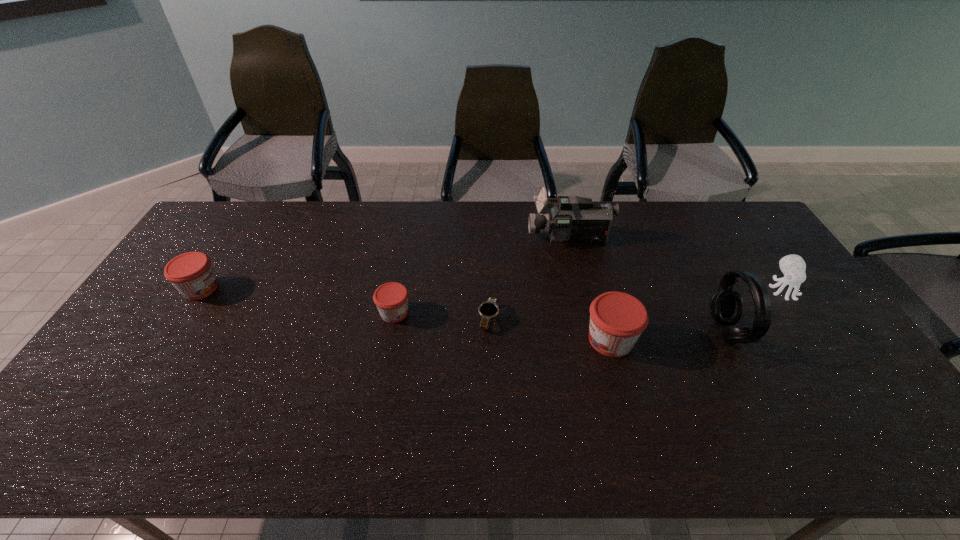
Where is `vacant space located on the front label of the leftmost jam`? vacant space located on the front label of the leftmost jam is located at coordinates (324, 288).

What are the coordinates of `free location located 0.230m on the front label of the second shortest object` in the screenshot? It's located at (490, 313).

Find the location of a particular element. The width and height of the screenshot is (960, 540). vacant space situated on the front label of the tallest jam is located at coordinates (515, 340).

Locate an element on the screen. The width and height of the screenshot is (960, 540). vacant space located 0.190m on the front label of the tallest jam is located at coordinates (515, 340).

This screenshot has height=540, width=960. Find the location of `vacant space located 0.270m on the front label of the tallest jam`. vacant space located 0.270m on the front label of the tallest jam is located at coordinates (486, 340).

The height and width of the screenshot is (540, 960). I want to click on blank space located on the earcups of the second object from right to left, so click(681, 332).

Where is `vacant space located 0.200m on the earcups of the second object from right to left`? Image resolution: width=960 pixels, height=540 pixels. vacant space located 0.200m on the earcups of the second object from right to left is located at coordinates (642, 332).

At what (x,y) coordinates should I click in order to perform the action: click on vacant position located 0.110m on the earcups of the second object from right to left. Please return your answer as a coordinate pair (x, y). This screenshot has height=540, width=960. Looking at the image, I should click on (674, 332).

This screenshot has width=960, height=540. I want to click on vacant space located 0.290m on the front-facing side of the rightmost object, so click(x=849, y=386).

You are a GUI agent. You are given a task and a screenshot of the screen. Output one action in this format:
    pyautogui.click(x=<x>, y=<y>)
    Task: Click on the free space located 0.280m on the front-facing side of the farthest object
    The width and height of the screenshot is (960, 540).
    Given the screenshot: What is the action you would take?
    pyautogui.click(x=448, y=238)